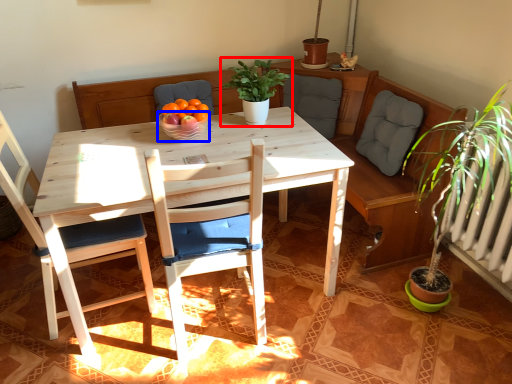
Question: Which of the following is the closest to the observer, houseplant (highlighted by a red box) or glass bowl (highlighted by a blue box)?

Choices:
 (A) houseplant
 (B) glass bowl

Answer: (B)